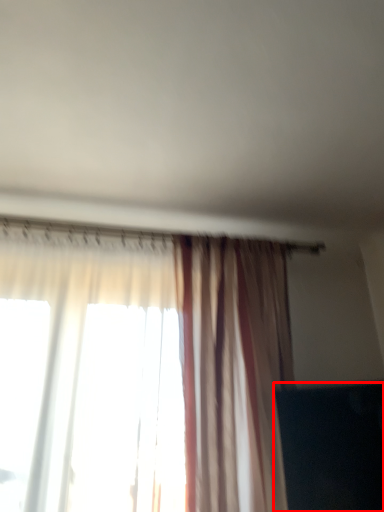
Question: Where is dark (annotated by the red box) located in relation to curtain in the image?

Choices:
 (A) right
 (B) left

Answer: (A)